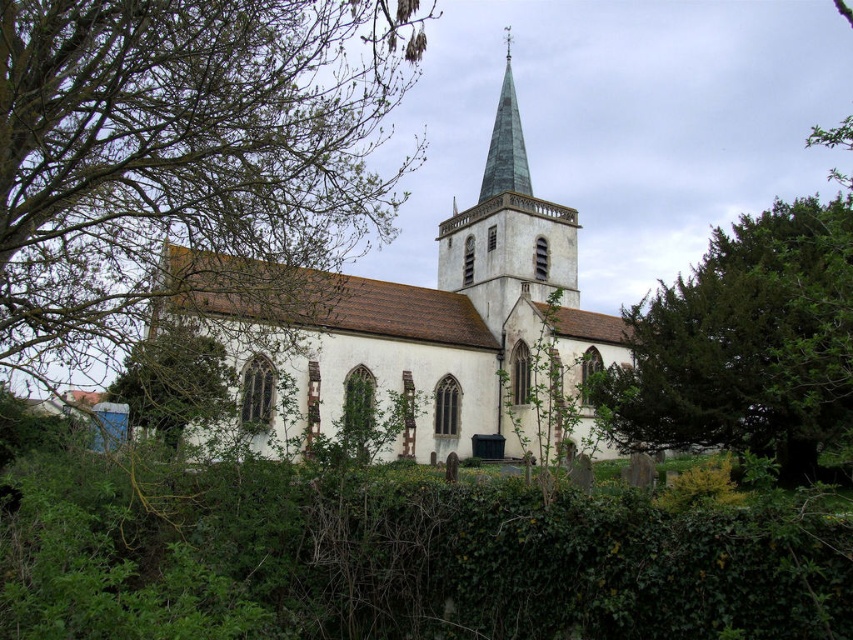
Does dark green leafy tree at right appear over green glass steeple at upper center?

No.

Does dark green leafy tree at right have a lesser height compared to green glass steeple at upper center?

Yes.

Does point (757, 321) come farther from viewer compared to point (511, 118)?

No, it is not.

Locate an element on the screen. The image size is (853, 640). dark green leafy tree at right is located at coordinates (746, 342).

Does green leafy tree at upper left have a greater width compared to white stone church at center?

Incorrect, green leafy tree at upper left's width does not surpass white stone church at center's.

Is green leafy tree at upper left in front of white stone church at center?

Yes, it is.

Is point (68, 104) positioned after point (598, 426)?

No, (68, 104) is closer to viewer.

What are the coordinates of `green leafy tree at upper left` in the screenshot? It's located at [x=183, y=150].

Does dark green leafy tree at right have a larger size compared to green glass spire at upper center?

Indeed, dark green leafy tree at right has a larger size compared to green glass spire at upper center.

Is dark green leafy tree at right below green glass spire at upper center?

Correct, dark green leafy tree at right is located below green glass spire at upper center.

Is point (734, 384) positioned behind point (518, 124)?

No.

Where is `dark green leafy tree at right`? Image resolution: width=853 pixels, height=640 pixels. dark green leafy tree at right is located at coordinates (746, 342).